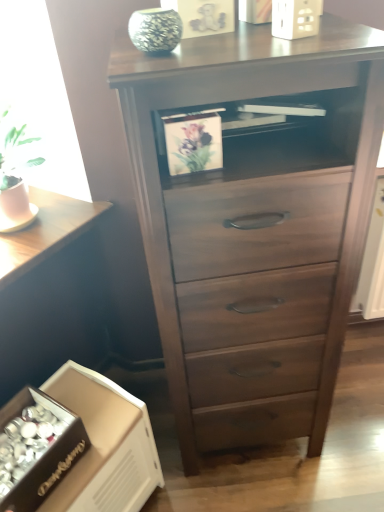
The image size is (384, 512). In order to click on vacant area that is situated to the right of dark wood chest of drawers at center in this screenshot , I will do 355,407.